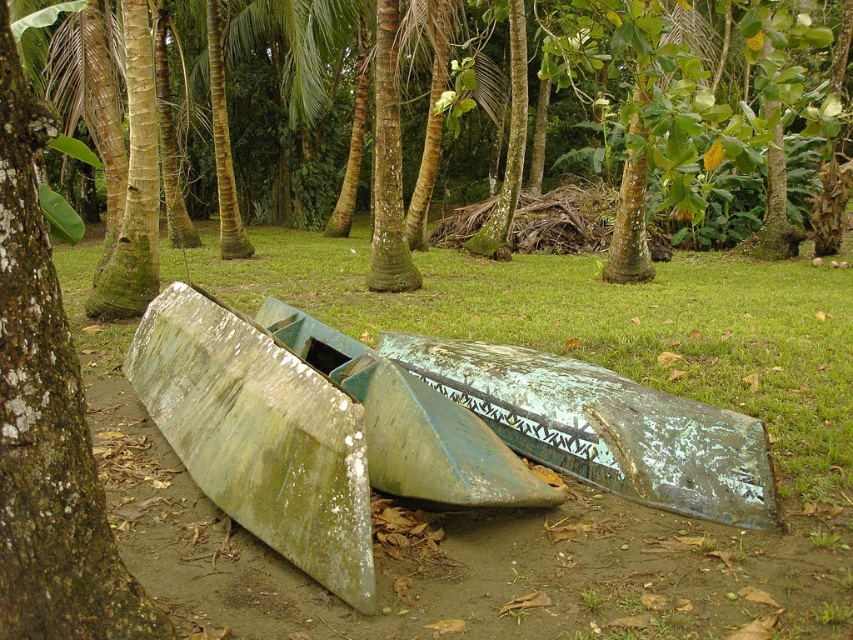
Between point (308, 132) and point (337, 372), which one is positioned behind?

Positioned behind is point (308, 132).

Looking at this image, is green mossy canoe at lower center smaller than green weathered wood boat at center?

Actually, green mossy canoe at lower center might be larger than green weathered wood boat at center.

Who is more distant from viewer, [374,289] or [456,445]?

The point [374,289] is more distant.

This screenshot has width=853, height=640. Identify the location of green mossy canoe at lower center. [x=674, y=129].

Is green grass at center positioned behind green weathered wood boat at center?

No.

This screenshot has height=640, width=853. What do you see at coordinates (563, 480) in the screenshot? I see `green grass at center` at bounding box center [563, 480].

Between point (741, 380) and point (410, 376), which one is positioned in front?

Point (410, 376)

What are the coordinates of `green grass at center` in the screenshot? It's located at (563, 480).

Describe the element at coordinates (563, 480) in the screenshot. I see `green grass at center` at that location.

Which is more to the right, green grass at center or green mossy wood boat at lower left?

From the viewer's perspective, green mossy wood boat at lower left appears more on the right side.

Which is behind, point (416, 564) or point (157, 412)?

Positioned behind is point (157, 412).

At what (x,y) coordinates should I click in order to perform the action: click on green grass at center. Please return your answer as a coordinate pair (x, y). Image resolution: width=853 pixels, height=640 pixels. Looking at the image, I should click on (563, 480).